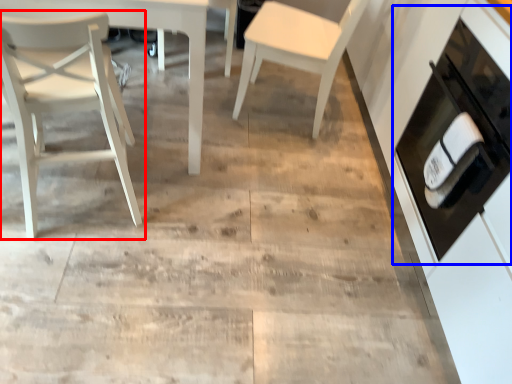
Question: Which object is further to the camera taking this photo, chair (highlighted by a red box) or cabinetry (highlighted by a blue box)?

Choices:
 (A) chair
 (B) cabinetry

Answer: (B)